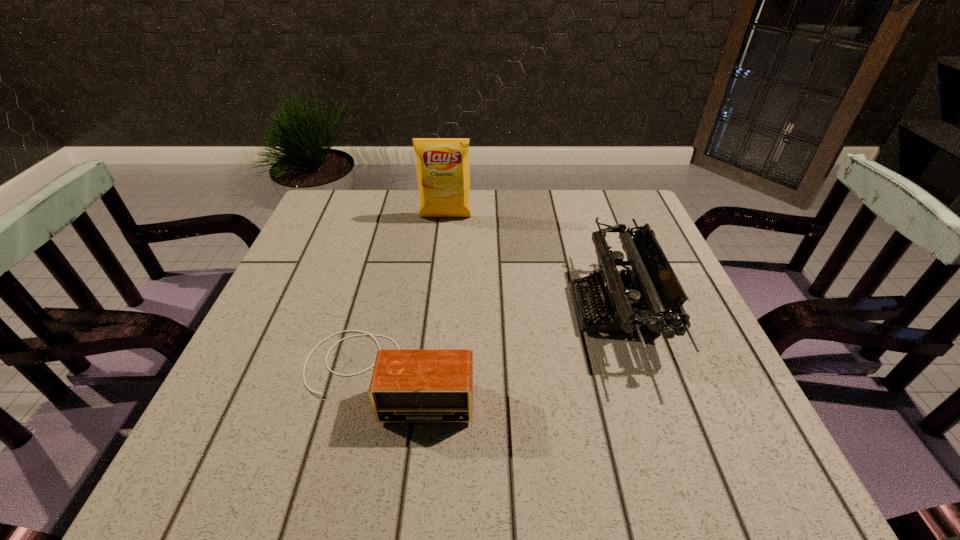
This screenshot has width=960, height=540. What are the coordinates of `the farthest object` in the screenshot? It's located at (442, 164).

Find the location of a particular element. The image size is (960, 540). the tallest object is located at coordinates (442, 164).

The height and width of the screenshot is (540, 960). I want to click on the second shortest object, so click(x=647, y=298).

Find the location of a particular element. the rightmost object is located at coordinates (647, 298).

At what (x,y) coordinates should I click in order to perform the action: click on the shortest object. Please return your answer as a coordinate pair (x, y). Looking at the image, I should click on (408, 385).

Where is `vacant area located 0.220m on the front of the farthest object with the logo`? vacant area located 0.220m on the front of the farthest object with the logo is located at coordinates (440, 275).

The width and height of the screenshot is (960, 540). Identify the location of vacant space located 0.350m on the typing side of the typewriter. (411, 309).

At what (x,y) coordinates should I click in order to perform the action: click on vacant space located 0.260m on the typing side of the typewriter. Please return your answer as a coordinate pair (x, y). The image size is (960, 540). Looking at the image, I should click on (453, 309).

Identify the location of blank area located on the typing side of the typewriter. The width and height of the screenshot is (960, 540). (467, 309).

I want to click on free spot located 0.050m on the front-facing side of the shortest object, so click(x=372, y=454).